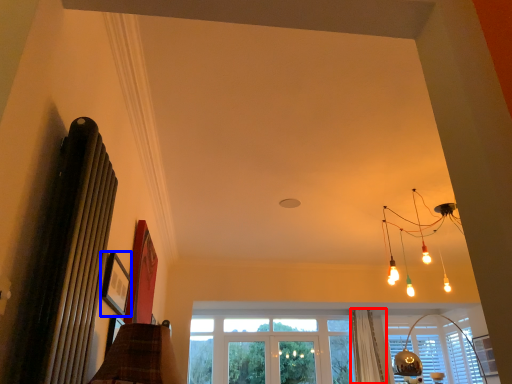
Question: Which object appears closest to the camera in this image, curtain (highlighted by a red box) or picture frame (highlighted by a blue box)?

Choices:
 (A) curtain
 (B) picture frame

Answer: (B)